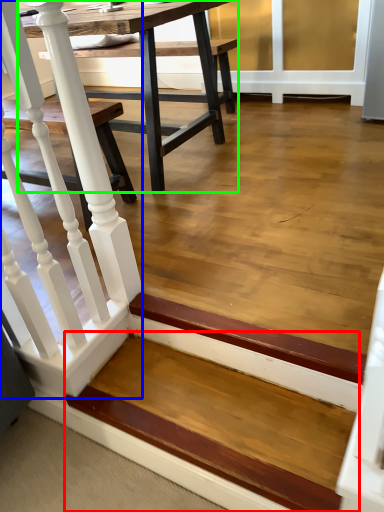
Question: Which object is the farthest from stairwell (highlighted by a red box)? Choose among these: rail (highlighted by a blue box) or table (highlighted by a green box).

Choices:
 (A) rail
 (B) table

Answer: (B)